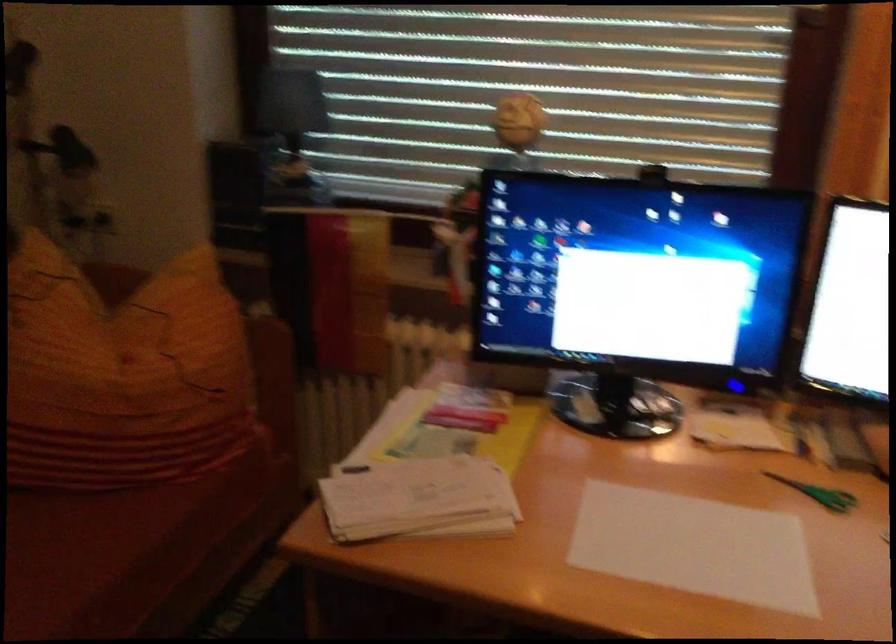
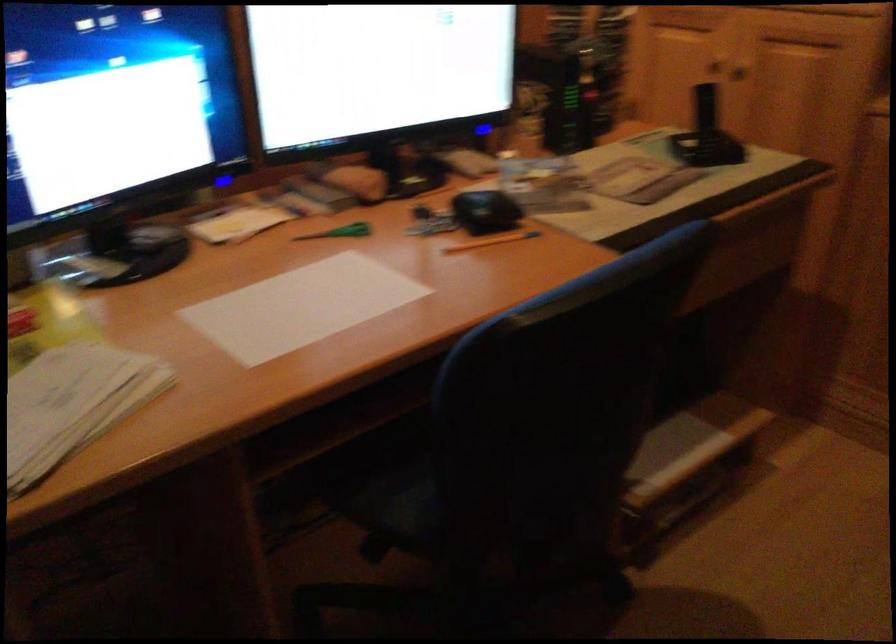
Where in the second image is the point corresponding to point (817, 489) from the first image?

(340, 232)